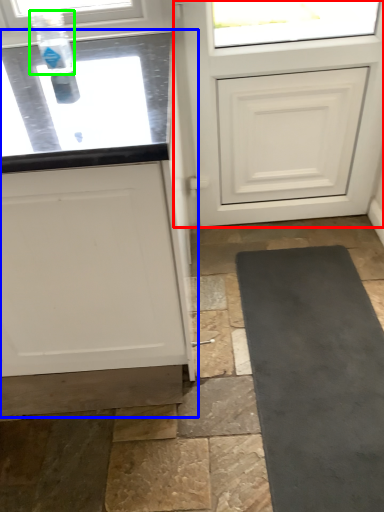
Question: Which is nearer to the door (highlighted by a red box)? cabinetry (highlighted by a blue box) or bottle (highlighted by a green box).

Choices:
 (A) cabinetry
 (B) bottle

Answer: (A)